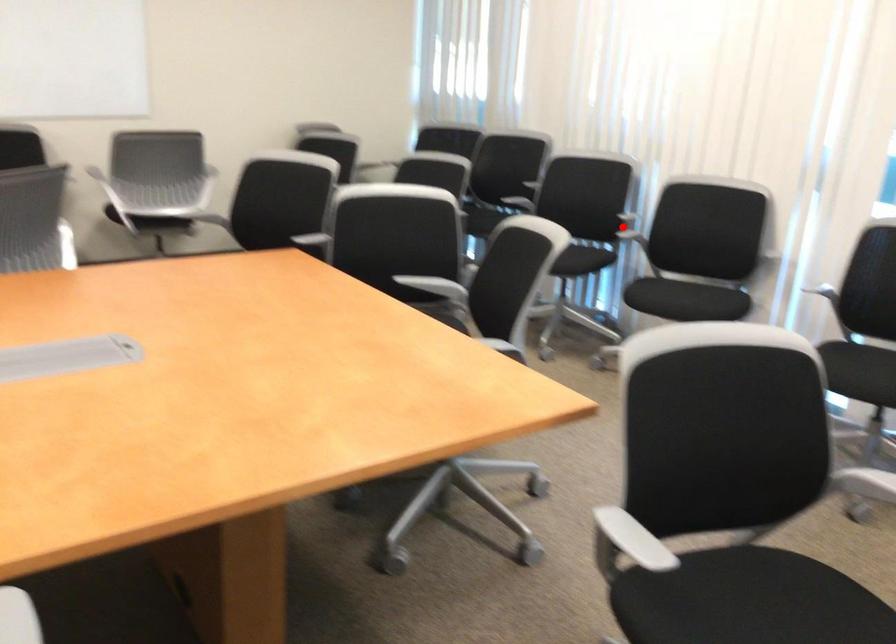
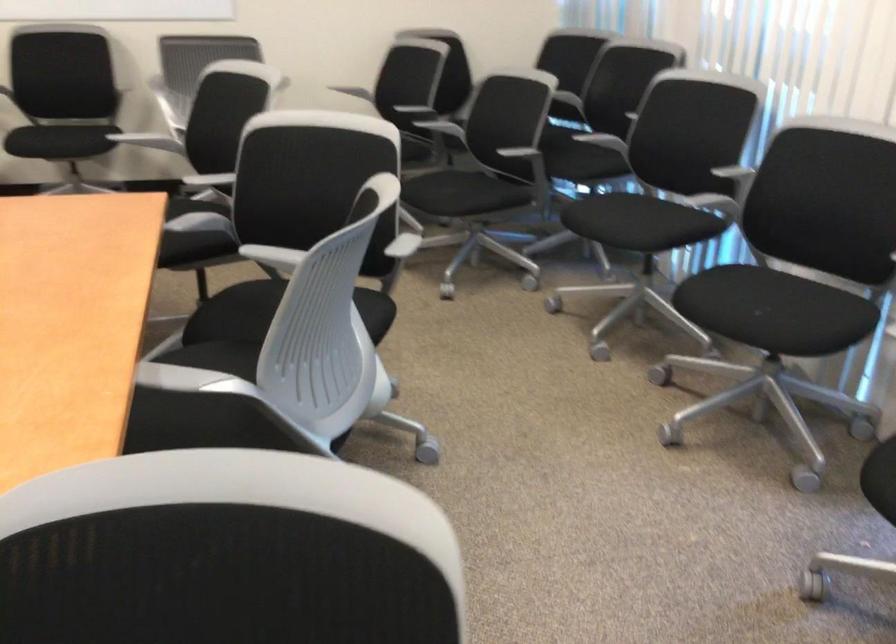
Question: I am providing you with two images of the same scene from different viewpoints. Given a red point in image1, look at the same physical point in image2. Is it:

Choices:
 (A) Closer to the viewpoint
 (B) Farther from the viewpoint

Answer: (A)